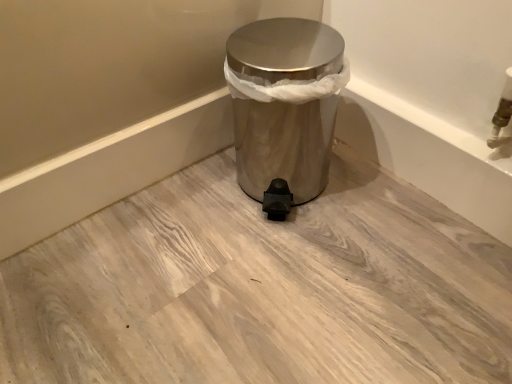
Identify the location of vacant space situated on the left part of polished stainless steel trash can at center. Image resolution: width=512 pixels, height=384 pixels. (202, 196).